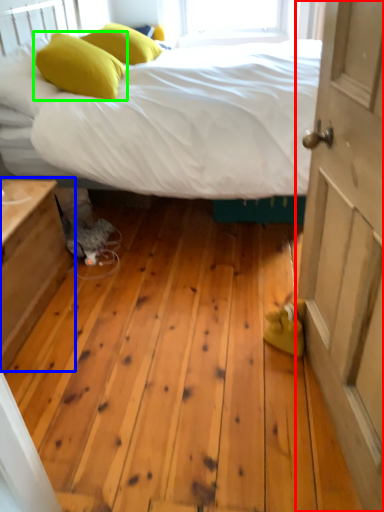
Question: Based on their relative distances, which object is nearer to door (highlighted by a red box)? Choose from nightstand (highlighted by a blue box) and pillow (highlighted by a green box).

Choices:
 (A) nightstand
 (B) pillow

Answer: (A)